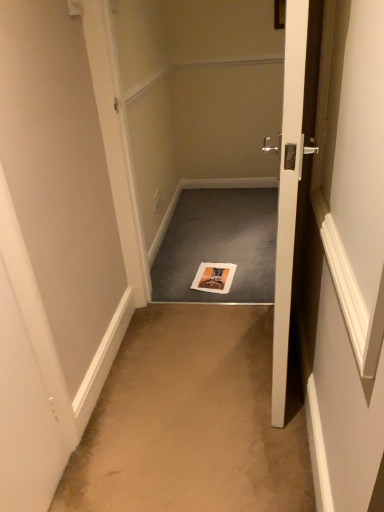
Question: From the image's perspective, would you say orange matte magazine at center is shown under beige carpet at center?

Choices:
 (A) yes
 (B) no

Answer: (B)

Question: Would you consider orange matte magazine at center to be distant from beige carpet at center?

Choices:
 (A) no
 (B) yes

Answer: (A)

Question: Considering the relative positions of orange matte magazine at center and beige carpet at center in the image provided, is orange matte magazine at center to the right of beige carpet at center from the viewer's perspective?

Choices:
 (A) no
 (B) yes

Answer: (B)

Question: Can you confirm if orange matte magazine at center is positioned to the left of beige carpet at center?

Choices:
 (A) no
 (B) yes

Answer: (A)

Question: Is beige carpet at center located within orange matte magazine at center?

Choices:
 (A) no
 (B) yes

Answer: (A)

Question: Can you confirm if orange matte magazine at center is wider than beige carpet at center?

Choices:
 (A) no
 (B) yes

Answer: (A)

Question: From a real-world perspective, is white glossy door at center beneath beige carpet at center?

Choices:
 (A) yes
 (B) no

Answer: (B)

Question: Is white glossy door at center positioned beyond the bounds of beige carpet at center?

Choices:
 (A) no
 (B) yes

Answer: (B)

Question: Considering the relative sizes of white glossy door at center and beige carpet at center in the image provided, is white glossy door at center bigger than beige carpet at center?

Choices:
 (A) yes
 (B) no

Answer: (A)

Question: From a real-world perspective, does white glossy door at center stand above beige carpet at center?

Choices:
 (A) no
 (B) yes

Answer: (B)

Question: From the image's perspective, is white glossy door at center located beneath beige carpet at center?

Choices:
 (A) no
 (B) yes

Answer: (A)

Question: Is white glossy door at center taller than beige carpet at center?

Choices:
 (A) yes
 (B) no

Answer: (A)

Question: Does gray carpet at center turn towards white glossy door at center?

Choices:
 (A) yes
 (B) no

Answer: (B)